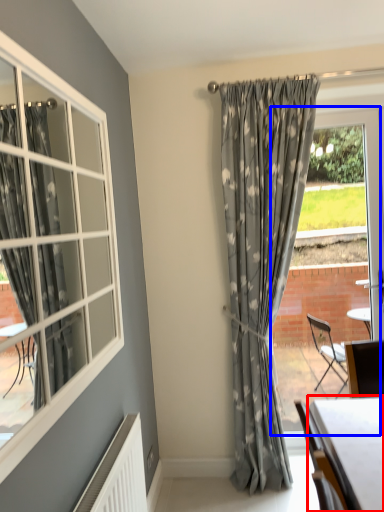
Question: Among these objects, which one is farthest to the camera, table (highlighted by a red box) or window frame (highlighted by a blue box)?

Choices:
 (A) table
 (B) window frame

Answer: (B)